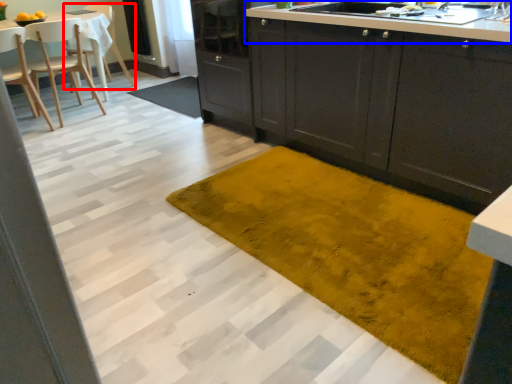
Question: Which of the following is the farthest to the observer, chair (highlighted by a red box) or countertop (highlighted by a blue box)?

Choices:
 (A) chair
 (B) countertop

Answer: (A)